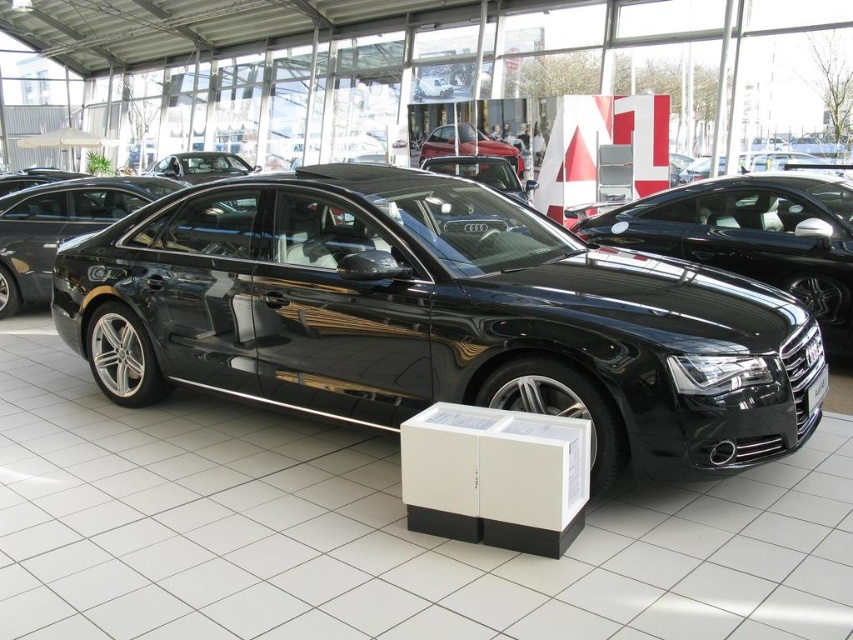
Can you confirm if glossy black car at center is positioned to the right of black metallic license plate at center?

Correct, you'll find glossy black car at center to the right of black metallic license plate at center.

Does point (799, 196) come farther from viewer compared to point (811, 397)?

Yes, point (799, 196) is farther from viewer.

Between point (843, 220) and point (817, 400), which one is positioned in front?

Positioned in front is point (817, 400).

Find the location of a particular element. This screenshot has width=853, height=640. glossy black car at center is located at coordinates (751, 236).

Is glossy black sedan at center thinner than glossy metallic car at center?

Incorrect, glossy black sedan at center's width is not less than glossy metallic car at center's.

Between glossy black sedan at center and glossy metallic car at center, which one is positioned lower?

Positioned lower is glossy black sedan at center.

Image resolution: width=853 pixels, height=640 pixels. Find the location of `glossy black sedan at center`. glossy black sedan at center is located at coordinates (434, 316).

Does glossy black car at center come behind glossy metallic car at center?

No, it is in front of glossy metallic car at center.

Between glossy black car at center and glossy metallic car at center, which one appears on the left side from the viewer's perspective?

glossy metallic car at center

At what (x,y) coordinates should I click in order to perform the action: click on glossy black car at center. Please return your answer as a coordinate pair (x, y). Looking at the image, I should click on (751, 236).

Identify the location of glossy black car at center. (751, 236).